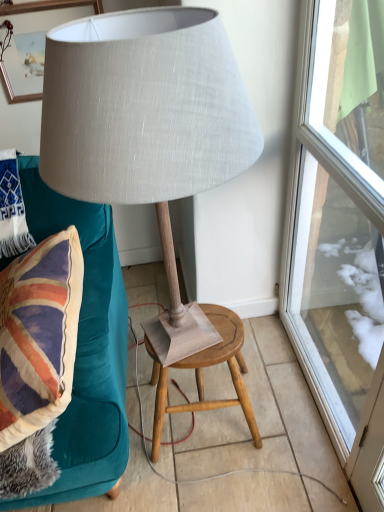
Question: Is white woven pillow at upper left positioned before transparent glass door at right?

Choices:
 (A) yes
 (B) no

Answer: (B)

Question: Is white woven pillow at upper left thinner than transparent glass door at right?

Choices:
 (A) yes
 (B) no

Answer: (B)

Question: Can you confirm if white woven pillow at upper left is positioned to the left of transparent glass door at right?

Choices:
 (A) yes
 (B) no

Answer: (A)

Question: Is white woven pillow at upper left positioned far away from transparent glass door at right?

Choices:
 (A) yes
 (B) no

Answer: (A)

Question: Does white woven pillow at upper left have a greater width compared to transparent glass door at right?

Choices:
 (A) no
 (B) yes

Answer: (B)

Question: From a real-world perspective, is white woven pillow at upper left over transparent glass door at right?

Choices:
 (A) yes
 (B) no

Answer: (A)

Question: Considering the relative sizes of transparent glass door at right and white woven pillow at upper left in the image provided, is transparent glass door at right taller than white woven pillow at upper left?

Choices:
 (A) no
 (B) yes

Answer: (B)

Question: Is transparent glass door at right positioned far away from white woven pillow at upper left?

Choices:
 (A) no
 (B) yes

Answer: (B)

Question: Is the surface of transparent glass door at right in direct contact with white woven pillow at upper left?

Choices:
 (A) no
 (B) yes

Answer: (A)

Question: Is transparent glass door at right at the left side of white woven pillow at upper left?

Choices:
 (A) no
 (B) yes

Answer: (A)

Question: Is transparent glass door at right at the right side of white woven pillow at upper left?

Choices:
 (A) no
 (B) yes

Answer: (B)

Question: Does transparent glass door at right have a larger size compared to white woven pillow at upper left?

Choices:
 (A) no
 (B) yes

Answer: (B)

Question: Is matte gray fabric lamp at center not near wooden stool at center?

Choices:
 (A) yes
 (B) no

Answer: (B)